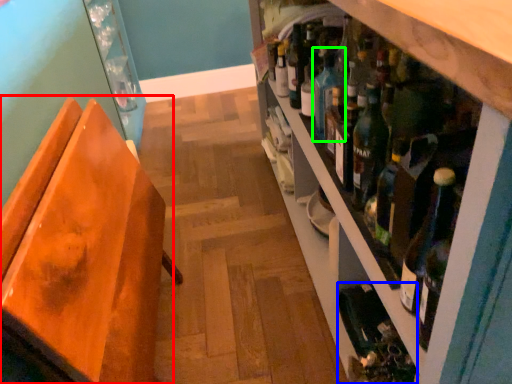
Question: Based on their relative distances, which object is farther from chair (highlighted by a red box)? Choose from wine bottle (highlighted by a blue box) and teal (highlighted by a green box).

Choices:
 (A) wine bottle
 (B) teal

Answer: (A)